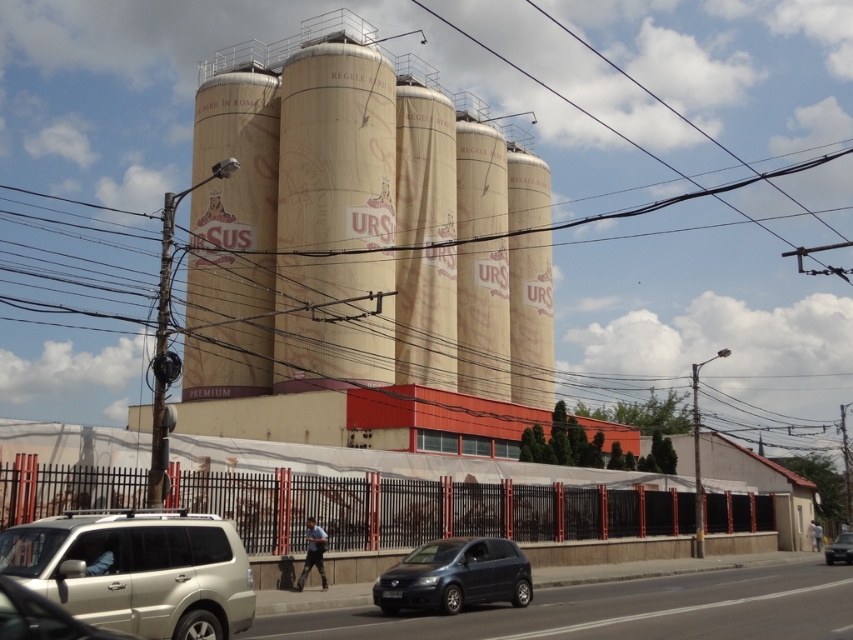
You are a delivery driver approaching the industrial site. You need to park your vehicle between the matte black car at lower center and the metallic silver suv at lower left. Which vehicle should you position your vehicle closer to if you want to maximize parking space efficiency?

The metallic silver suv at lower left is shorter than the matte black car at lower center. To maximize parking space efficiency, you should position your vehicle closer to the metallic silver suv at lower left since it is shorter, allowing more space for other vehicles.

You are a delivery driver needing to park your truck between the matte black car at lower center and the metallic silver suv at lower left. The truck requires a minimum of 12 meters of space to maneuver. Based on the scene, can you safely park your truck in this location?

The distance between the matte black car at lower center and the metallic silver suv at lower left is 10.48 meters, which is less than the required 12 meters for the truck to maneuver. Therefore, it is not safe to park the truck in this location.

You are a delivery driver arriving at the industrial facility. You need to park your vehicle between the matte black car at lower center and the metallic silver suv at lower left. Given that your truck is 2.5 meters wide, can you fit your truck between them without touching either vehicle?

The matte black car at lower center is wider than the metallic silver suv at lower left. However, since the exact distance between them isn not provided, we cannot determine if the 2.5 meter truck will fit. Please check the space between them first.